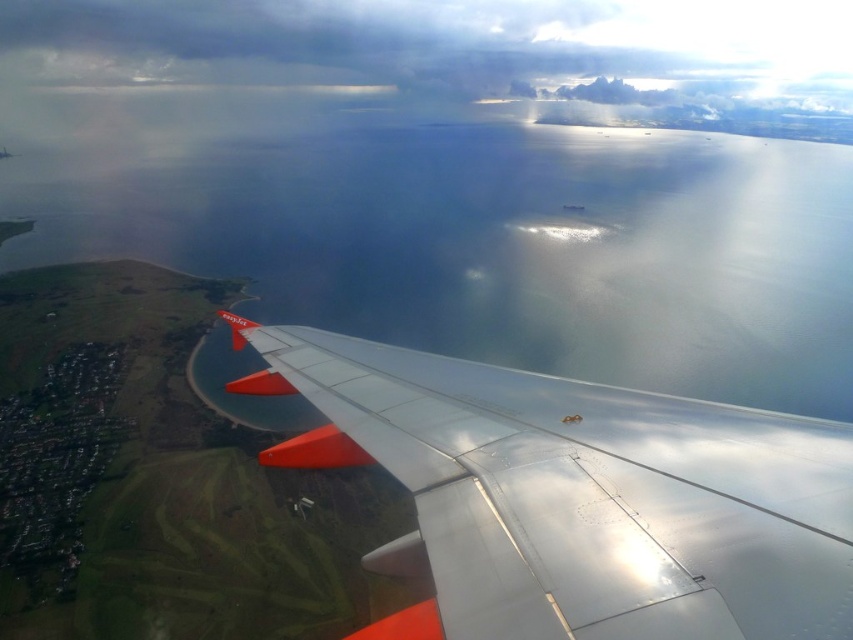
Question: Which point appears closest to the camera in this image?

Choices:
 (A) (380, 627)
 (B) (306, 506)

Answer: (A)

Question: Does metallic silver wing at lower right have a larger size compared to metallic silver wing at lower center?

Choices:
 (A) no
 (B) yes

Answer: (A)

Question: Is metallic silver wing at lower right closer to camera compared to metallic silver wing at lower center?

Choices:
 (A) no
 (B) yes

Answer: (B)

Question: Which object is farther from the camera taking this photo?

Choices:
 (A) metallic silver wing at lower center
 (B) metallic silver wing at lower right

Answer: (A)

Question: Can you confirm if metallic silver wing at lower right is positioned to the left of metallic silver wing at lower center?

Choices:
 (A) no
 (B) yes

Answer: (A)